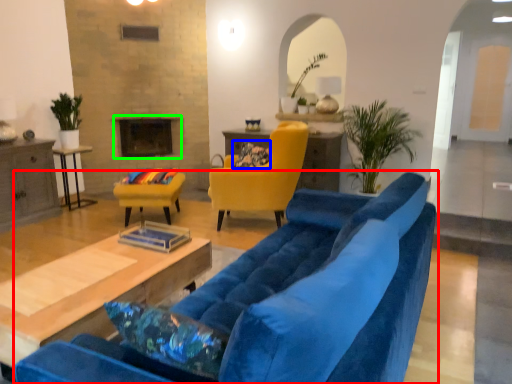
Question: Which object is the closest to the studio couch (highlighted by a red box)? Choose among these: pillow (highlighted by a blue box) or fireplace (highlighted by a green box).

Choices:
 (A) pillow
 (B) fireplace

Answer: (A)